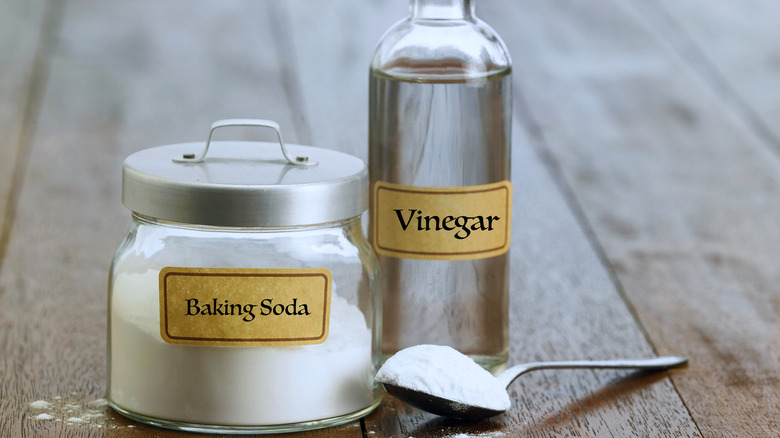
At what (x,y) coordinates should I click in order to perform the action: click on lid handle. Please return your answer as a coordinate pair (x, y). The width and height of the screenshot is (780, 438). Looking at the image, I should click on (239, 117).